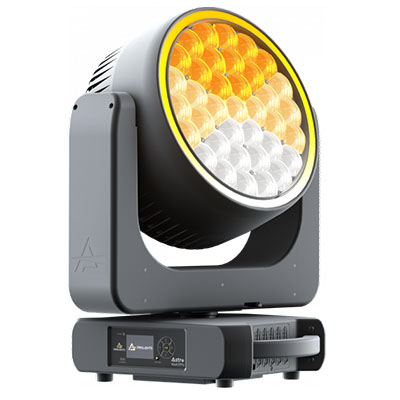
Locate an element on the screen. This screenshot has width=400, height=400. handle is located at coordinates (287, 349).